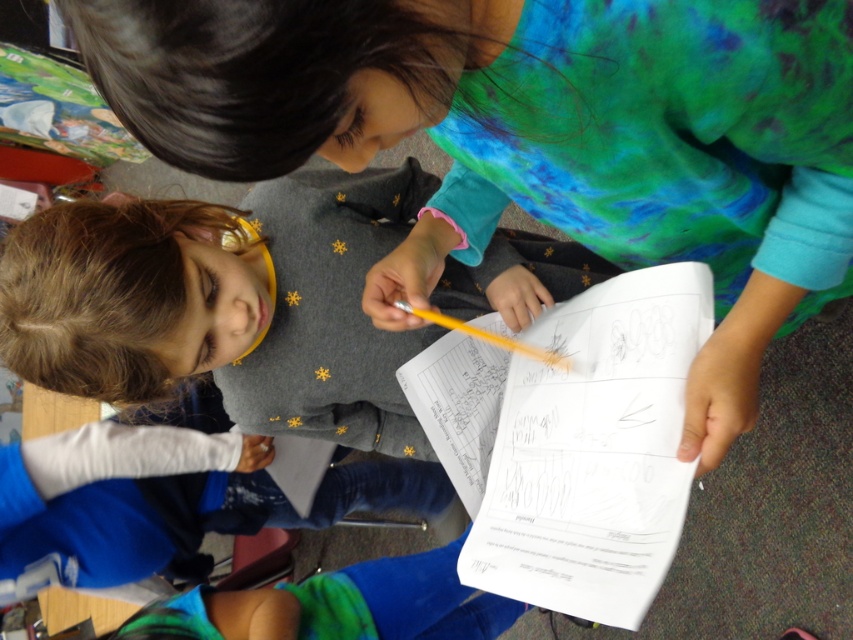
Image resolution: width=853 pixels, height=640 pixels. Describe the element at coordinates (109, 504) in the screenshot. I see `blue fabric pants at lower center` at that location.

Can you confirm if blue fabric pants at lower center is bigger than blue-green fleece pants at lower center?

Indeed, blue fabric pants at lower center has a larger size compared to blue-green fleece pants at lower center.

Is point (90, 474) behind point (506, 616)?

No, (90, 474) is closer to viewer.

This screenshot has height=640, width=853. I want to click on blue fabric pants at lower center, so click(109, 504).

Measure the distance between point (135, 342) and camera.

Point (135, 342) is 88.55 centimeters away from camera.

Who is lower down, gray sweater at center or blue fabric pants at lower center?

blue fabric pants at lower center is lower down.

Where is `gray sweater at center`? The image size is (853, 640). gray sweater at center is located at coordinates (224, 304).

Does point (511, 273) lie behind point (190, 609)?

No, it is not.

Locate an element on the screen. gray sweater at center is located at coordinates (224, 304).